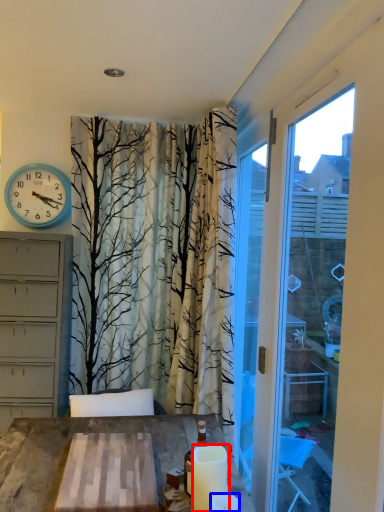
Question: Among these objects, which one is nearest to the camera, candle (highlighted by a red box) or candle (highlighted by a blue box)?

Choices:
 (A) candle
 (B) candle

Answer: (B)